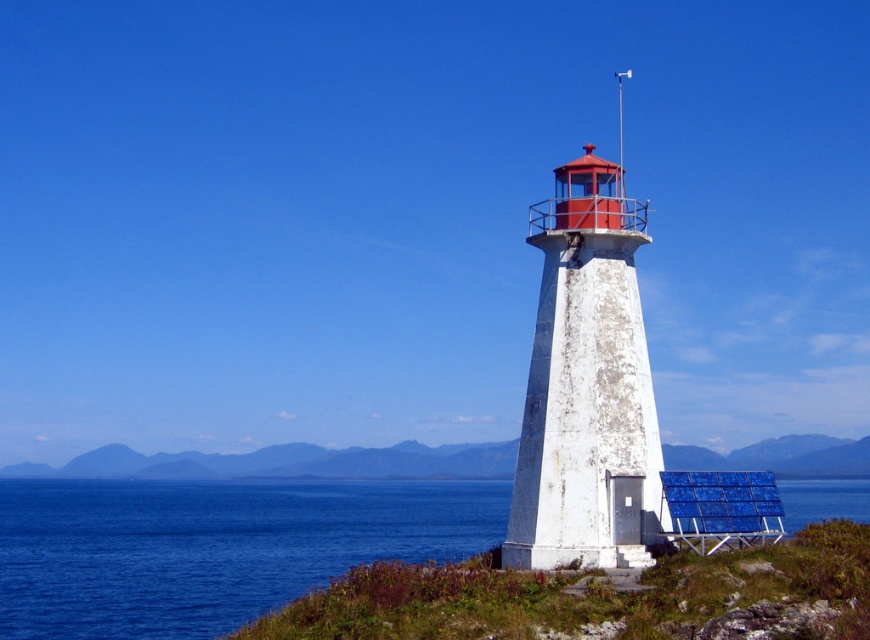
You are standing at the base of the lighthouse and want to reach the solar panel. The solar panel is located at point (x=248, y=612). There is an obstacle at point (x=616, y=316). Will you have to go around the obstacle to reach the solar panel?

Yes, you will have to go around the obstacle at point (x=616, y=316) because point (x=248, y=612) is behind it, meaning the obstacle is blocking the direct path to the solar panel.

You are a maintenance worker needing to walk from the white weathered lighthouse at center to the green grass at lower right. How far will you have to walk?

The distance between the white weathered lighthouse at center and the green grass at lower right is 56.38 meters, so you will have to walk 56.38 meters.

You are standing at the edge of the lighthouse and want to walk to the blue water at lower left. Which direction should you head relative to the white weathered lighthouse at center?

The blue water at lower left is positioned on the left side of the white weathered lighthouse at center, so you should head to the left side of the white weathered lighthouse at center to reach the blue water at lower left.